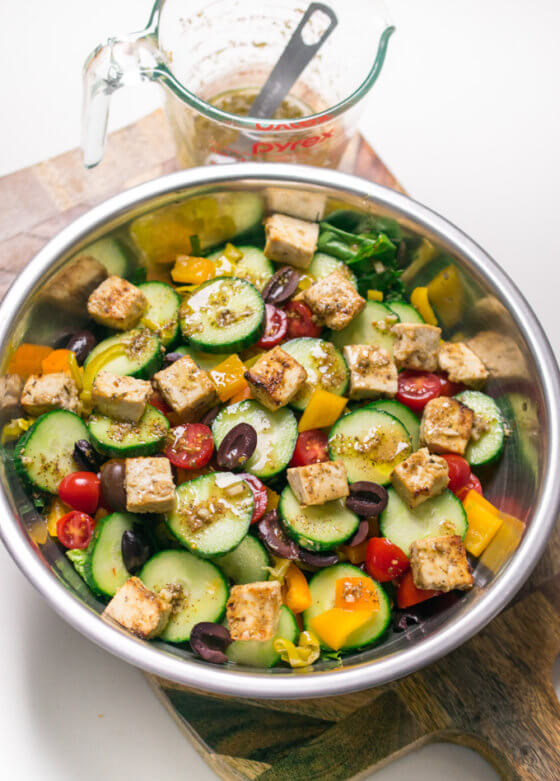
Locate an element on the screen. The image size is (560, 781). wood platter is located at coordinates (506, 676).